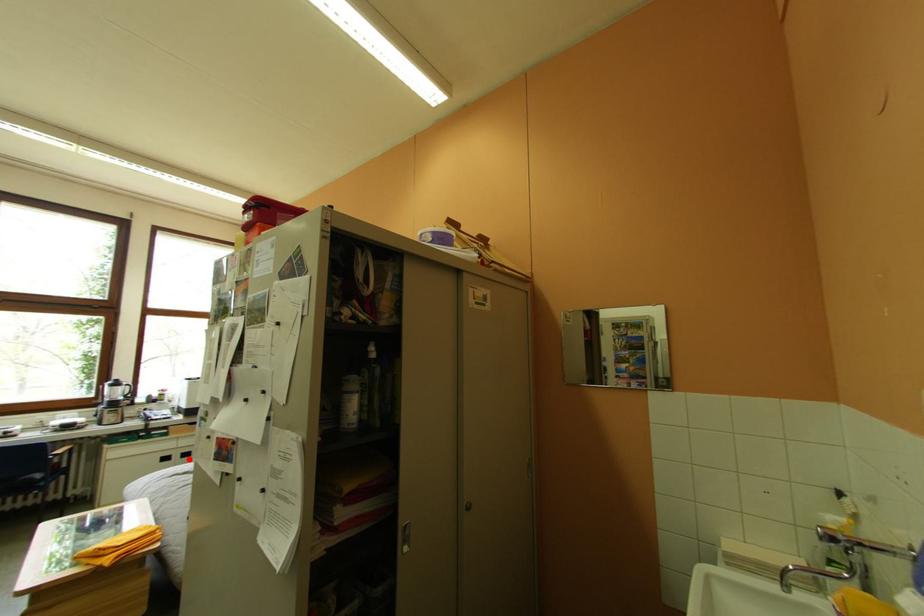
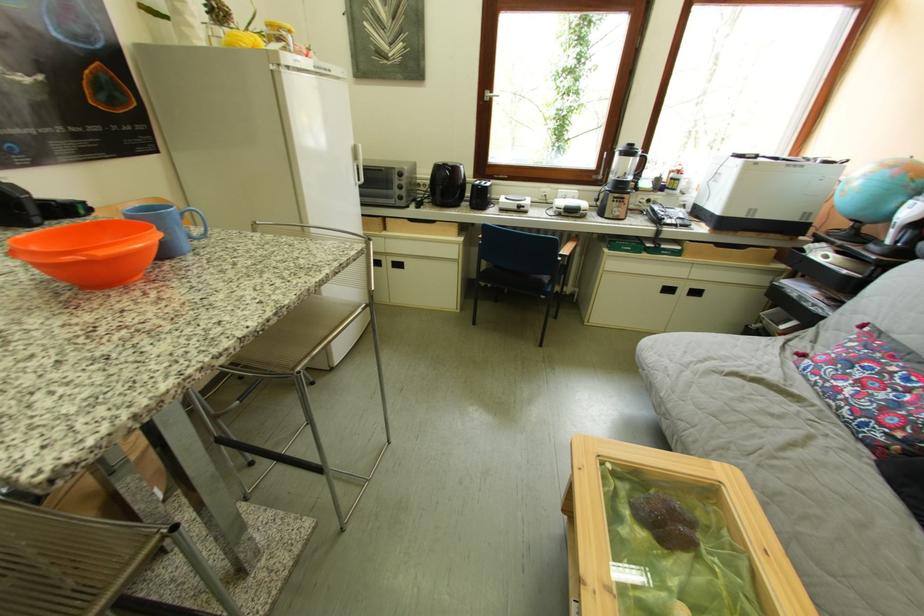
Question: I am providing you with two images of the same scene from different viewpoints. In image1, a red point is highlighted. Considering the same 3D point in image2, which of the following is correct?

Choices:
 (A) It is closer
 (B) It is farther

Answer: (B)